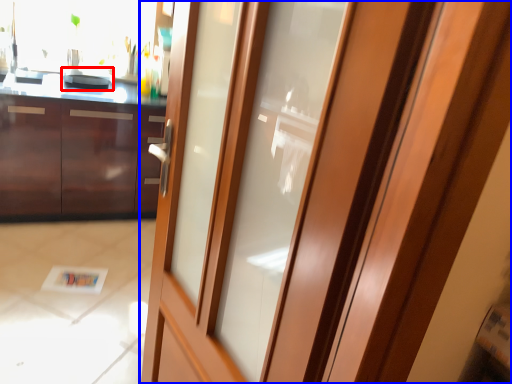
Question: Which object is closer to the camera taking this photo, appliance (highlighted by a red box) or door (highlighted by a blue box)?

Choices:
 (A) appliance
 (B) door

Answer: (B)